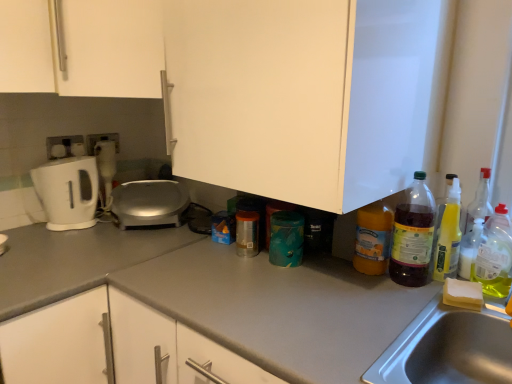
This screenshot has width=512, height=384. Identify the location of free spot in front of white glossy electric kettle at left. (48, 238).